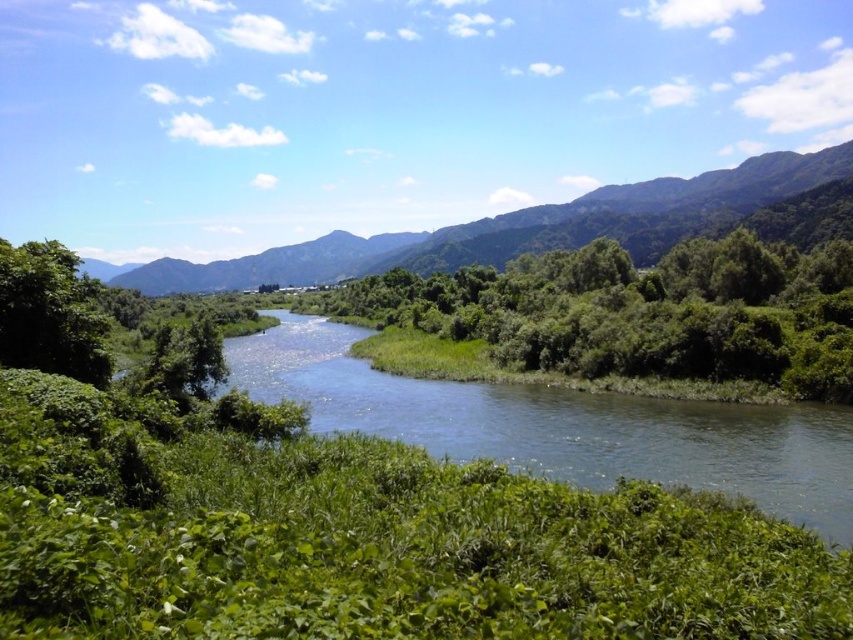
Is point (726, 355) behind point (674, 444)?

Yes, it is behind point (674, 444).

Can you confirm if green leafy shrub at center is thinner than blue smooth water at center?

Incorrect, green leafy shrub at center's width is not less than blue smooth water at center's.

In order to click on green leafy shrub at center in this screenshot , I will do `click(622, 320)`.

Who is more forward, (283, 259) or (73, 330)?

Point (73, 330) is more forward.

At what (x,y) coordinates should I click in order to perform the action: click on green leafy mountain at upper center. Please return your answer as a coordinate pair (x, y). The image size is (853, 640). Looking at the image, I should click on (517, 228).

Who is shorter, green leafy shrub at center or green leafy tree at left?

green leafy tree at left is shorter.

Measure the distance between point (364, 289) and camera.

A distance of 238.20 meters exists between point (364, 289) and camera.

Between point (660, 352) and point (39, 300), which one is positioned in front?

Positioned in front is point (39, 300).

The image size is (853, 640). I want to click on green leafy shrub at center, so click(622, 320).